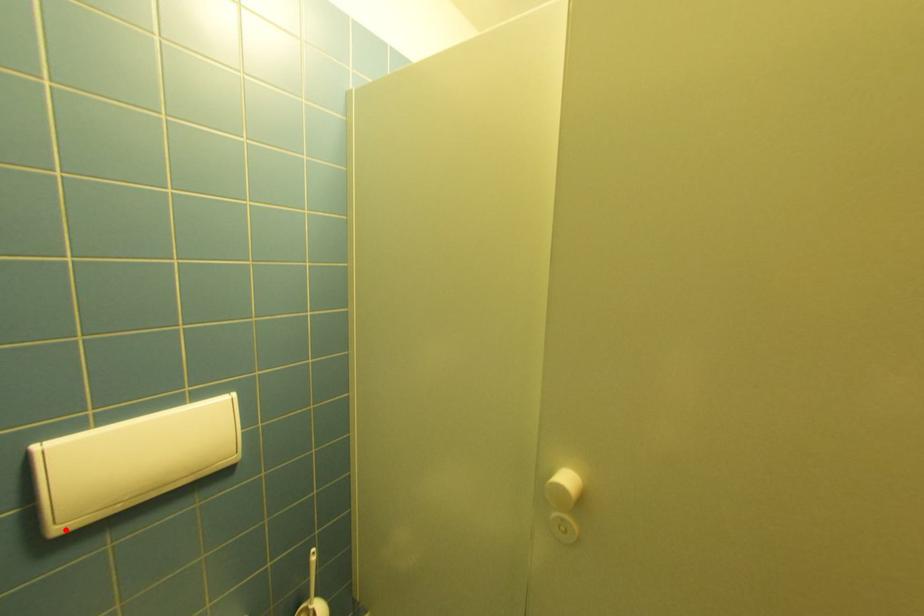
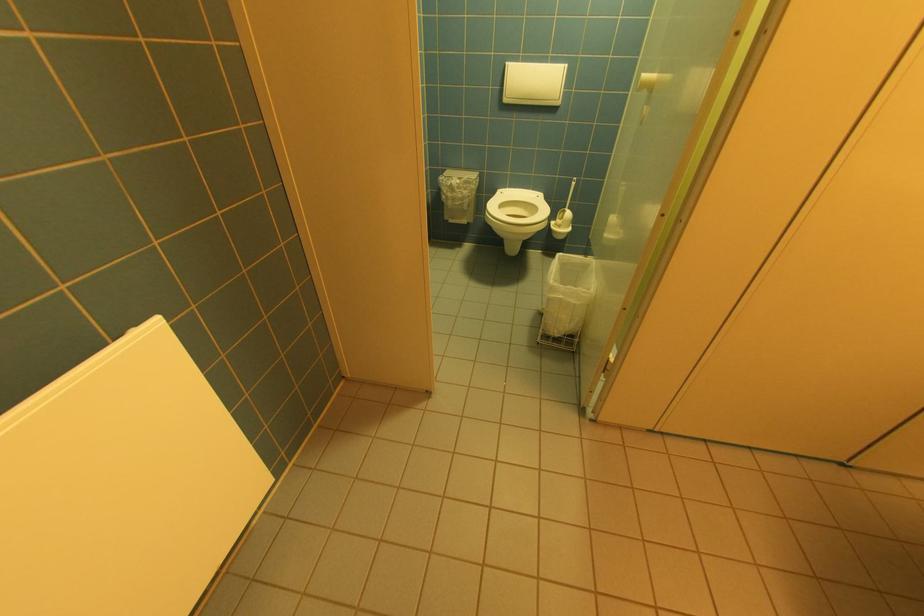
In the second image, find the point that corresponds to the highlighted location in the first image.

(512, 100)